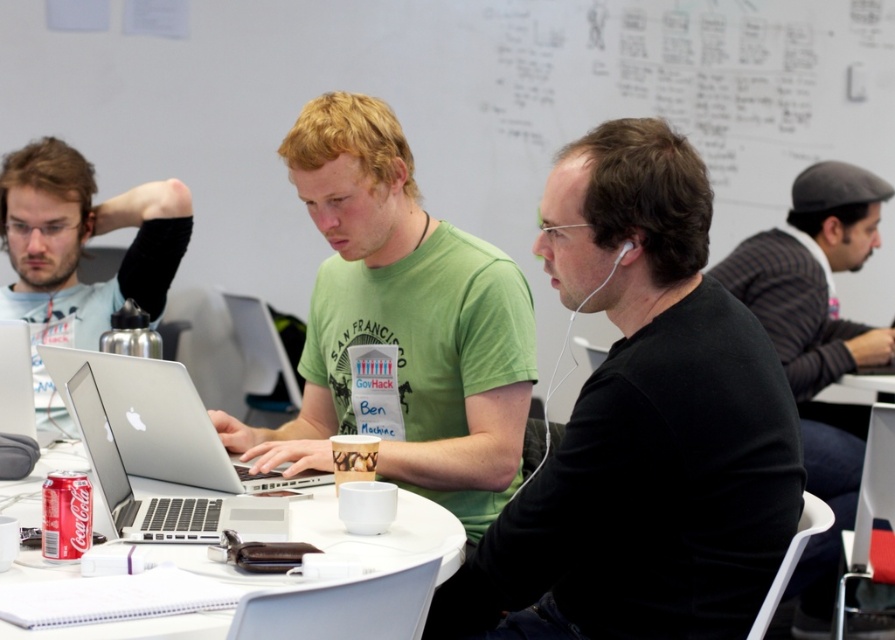
Question: Is black matte shirt at center bigger than matte black laptop at left?

Choices:
 (A) no
 (B) yes

Answer: (B)

Question: Is black matte shirt at center above matte black laptop at left?

Choices:
 (A) yes
 (B) no

Answer: (B)

Question: Which point is closer to the camera taking this photo?

Choices:
 (A) (43, 250)
 (B) (800, 348)

Answer: (A)

Question: Can you confirm if green matte t-shirt at center is bigger than silver metallic laptop at center?

Choices:
 (A) no
 (B) yes

Answer: (B)

Question: Which point is closer to the camera?

Choices:
 (A) matte black laptop at left
 (B) green matte t-shirt at center
 (C) silver metallic laptop at center

Answer: (C)

Question: Which of the following is the closest to the observer?

Choices:
 (A) silver metallic laptop at center
 (B) white plastic table at center

Answer: (B)